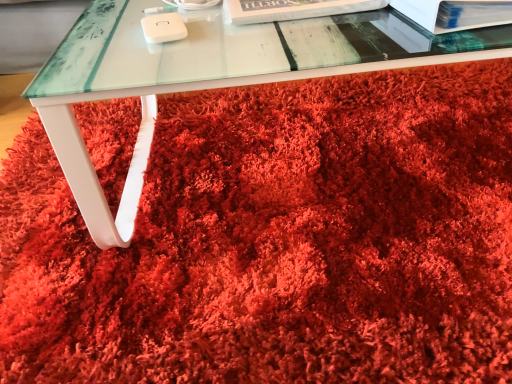
What do you see at coordinates (292, 9) in the screenshot?
I see `white paper at upper center, which ranks as the first paperback book in left-to-right order` at bounding box center [292, 9].

Locate an element on the screen. The height and width of the screenshot is (384, 512). white paper at upper center, arranged as the second paperback book when viewed from the right is located at coordinates (292, 9).

At what (x,y) coordinates should I click in order to perform the action: click on transparent glass table at center. Please return your answer as a coordinate pair (x, y). Image resolution: width=512 pixels, height=384 pixels. Looking at the image, I should click on (209, 75).

Where is `white paper at upper center, arranged as the second paperback book when viewed from the right`? This screenshot has width=512, height=384. white paper at upper center, arranged as the second paperback book when viewed from the right is located at coordinates (292, 9).

Looking at this image, considering the positions of objects white paper at upper center, arranged as the second paperback book when viewed from the right, and white glossy paperback book at upper right, acting as the 2th paperback book starting from the left, in the image provided, who is more to the left, white paper at upper center, arranged as the second paperback book when viewed from the right, or white glossy paperback book at upper right, acting as the 2th paperback book starting from the left,?

white paper at upper center, arranged as the second paperback book when viewed from the right.

Does white paper at upper center, which ranks as the first paperback book in left-to-right order, have a greater width compared to white glossy paperback book at upper right, acting as the 2th paperback book starting from the left?

Incorrect, the width of white paper at upper center, which ranks as the first paperback book in left-to-right order, does not surpass that of white glossy paperback book at upper right, acting as the 2th paperback book starting from the left.

From a real-world perspective, relative to white glossy paperback book at upper right, acting as the first paperback book starting from the right, is white paper at upper center, arranged as the second paperback book when viewed from the right, vertically above or below?

white paper at upper center, arranged as the second paperback book when viewed from the right, is below white glossy paperback book at upper right, acting as the first paperback book starting from the right.

Would you say white glossy paperback book at upper right, acting as the first paperback book starting from the right, is inside or outside white paper at upper center, arranged as the second paperback book when viewed from the right?

white glossy paperback book at upper right, acting as the first paperback book starting from the right, is not enclosed by white paper at upper center, arranged as the second paperback book when viewed from the right.

Is white glossy paperback book at upper right, acting as the first paperback book starting from the right, facing away from white paper at upper center, which ranks as the first paperback book in left-to-right order?

That's not correct — white glossy paperback book at upper right, acting as the first paperback book starting from the right, is not looking away from white paper at upper center, which ranks as the first paperback book in left-to-right order.

Considering the relative sizes of white glossy paperback book at upper right, acting as the 2th paperback book starting from the left, and white paper at upper center, arranged as the second paperback book when viewed from the right, in the image provided, is white glossy paperback book at upper right, acting as the 2th paperback book starting from the left, thinner than white paper at upper center, arranged as the second paperback book when viewed from the right,?

No, white glossy paperback book at upper right, acting as the 2th paperback book starting from the left, is not thinner than white paper at upper center, arranged as the second paperback book when viewed from the right.

From the image's perspective, relative to white paper at upper center, which ranks as the first paperback book in left-to-right order, is white glossy paperback book at upper right, acting as the first paperback book starting from the right, above or below?

From the image's perspective, white glossy paperback book at upper right, acting as the first paperback book starting from the right, appears below white paper at upper center, which ranks as the first paperback book in left-to-right order.

Considering their positions, is transparent glass table at center located in front of or behind white paper at upper center, arranged as the second paperback book when viewed from the right?

Clearly, transparent glass table at center is in front of white paper at upper center, arranged as the second paperback book when viewed from the right.

Looking at this image, is transparent glass table at center thinner than white paper at upper center, arranged as the second paperback book when viewed from the right?

No, transparent glass table at center is not thinner than white paper at upper center, arranged as the second paperback book when viewed from the right.

Is point (124, 194) positioned before point (277, 6)?

No, (124, 194) is further to viewer.

Between transparent glass table at center and white paper at upper center, arranged as the second paperback book when viewed from the right, which one appears on the left side from the viewer's perspective?

From the viewer's perspective, transparent glass table at center appears more on the left side.

Is point (250, 23) closer or farther from the camera than point (134, 36)?

Point (250, 23) is farther from the camera than point (134, 36).

Looking at their sizes, would you say white paper at upper center, which ranks as the first paperback book in left-to-right order, is wider or thinner than transparent glass table at center?

In the image, white paper at upper center, which ranks as the first paperback book in left-to-right order, appears to be more narrow than transparent glass table at center.

Is white paper at upper center, arranged as the second paperback book when viewed from the right, positioned beyond the bounds of transparent glass table at center?

That's correct, white paper at upper center, arranged as the second paperback book when viewed from the right, is outside of transparent glass table at center.

From the image's perspective, is white paper at upper center, which ranks as the first paperback book in left-to-right order, under transparent glass table at center?

Yes, from the image's perspective, white paper at upper center, which ranks as the first paperback book in left-to-right order, is below transparent glass table at center.

Between point (204, 60) and point (484, 22), which one is positioned behind?

Positioned behind is point (204, 60).

From the image's perspective, which is above, transparent glass table at center or white glossy paperback book at upper right, acting as the 2th paperback book starting from the left?

transparent glass table at center, from the image's perspective.

Can you confirm if transparent glass table at center is taller than white glossy paperback book at upper right, acting as the 2th paperback book starting from the left?

Incorrect, the height of transparent glass table at center is not larger of that of white glossy paperback book at upper right, acting as the 2th paperback book starting from the left.

Is transparent glass table at center oriented away from white glossy paperback book at upper right, acting as the 2th paperback book starting from the left?

No, transparent glass table at center is not facing away from white glossy paperback book at upper right, acting as the 2th paperback book starting from the left.

Does point (444, 27) lie behind point (250, 83)?

Yes, point (444, 27) is behind point (250, 83).

Is white glossy paperback book at upper right, acting as the first paperback book starting from the right, far from transparent glass table at center?

No, white glossy paperback book at upper right, acting as the first paperback book starting from the right, is in close proximity to transparent glass table at center.

From a real-world perspective, which object stands above the other?

white glossy paperback book at upper right, acting as the first paperback book starting from the right, is physically above.

Which object is positioned more to the left, white glossy paperback book at upper right, acting as the first paperback book starting from the right, or transparent glass table at center?

transparent glass table at center is more to the left.

I want to click on paperback book above the white glossy paperback book at upper right, acting as the first paperback book starting from the right (from the image's perspective), so click(292, 9).

The image size is (512, 384). I want to click on paperback book in front of the white paper at upper center, arranged as the second paperback book when viewed from the right, so click(x=455, y=13).

Considering their positions, is white glossy paperback book at upper right, acting as the first paperback book starting from the right, positioned further to transparent glass table at center than white paper at upper center, arranged as the second paperback book when viewed from the right?

white glossy paperback book at upper right, acting as the first paperback book starting from the right, is further to transparent glass table at center.

From the image, which object appears to be nearer to white paper at upper center, arranged as the second paperback book when viewed from the right, white glossy paperback book at upper right, acting as the first paperback book starting from the right, or transparent glass table at center?

white glossy paperback book at upper right, acting as the first paperback book starting from the right, is closer to white paper at upper center, arranged as the second paperback book when viewed from the right.

Looking at the image, which one is located closer to transparent glass table at center, white paper at upper center, which ranks as the first paperback book in left-to-right order, or white glossy paperback book at upper right, acting as the 2th paperback book starting from the left?

Among the two, white paper at upper center, which ranks as the first paperback book in left-to-right order, is located nearer to transparent glass table at center.

From the image, which object appears to be farther from white glossy paperback book at upper right, acting as the first paperback book starting from the right, transparent glass table at center or white paper at upper center, which ranks as the first paperback book in left-to-right order?

The object further to white glossy paperback book at upper right, acting as the first paperback book starting from the right, is transparent glass table at center.

Looking at this image, considering their positions, is transparent glass table at center positioned further to white paper at upper center, arranged as the second paperback book when viewed from the right, than white glossy paperback book at upper right, acting as the first paperback book starting from the right?

The object further to white paper at upper center, arranged as the second paperback book when viewed from the right, is transparent glass table at center.

When comparing their distances from white glossy paperback book at upper right, acting as the first paperback book starting from the right, does white paper at upper center, arranged as the second paperback book when viewed from the right, or transparent glass table at center seem closer?

The object closer to white glossy paperback book at upper right, acting as the first paperback book starting from the right, is white paper at upper center, arranged as the second paperback book when viewed from the right.

The image size is (512, 384). I want to click on paperback book between transparent glass table at center and white glossy paperback book at upper right, acting as the 2th paperback book starting from the left, so click(x=292, y=9).